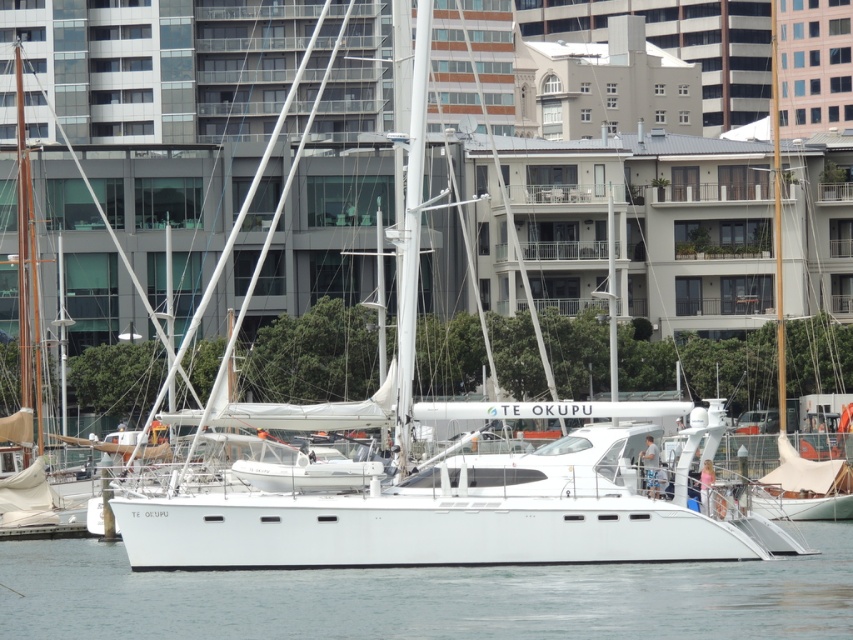
Does white smooth water at center appear under white matte sailboat at right?

Yes, white smooth water at center is below white matte sailboat at right.

How distant is white smooth water at center from white matte sailboat at right?

white smooth water at center is 25.96 meters from white matte sailboat at right.

You are a GUI agent. You are given a task and a screenshot of the screen. Output one action in this format:
    pyautogui.click(x=<x>, y=<y>)
    Task: Click on the white smooth water at center
    
    Given the screenshot: What is the action you would take?
    pyautogui.click(x=428, y=596)

Locate an element on the screen. white smooth water at center is located at coordinates (428, 596).